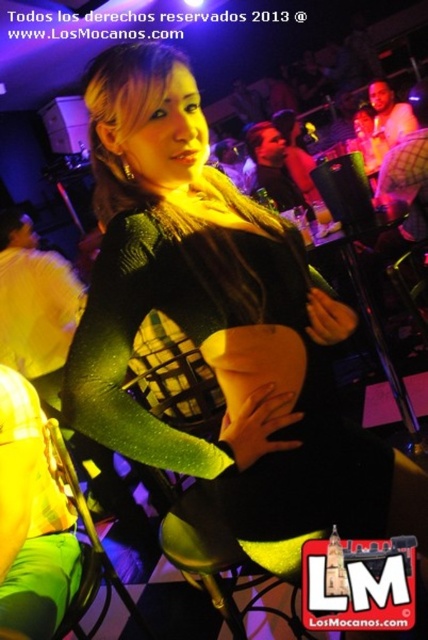
You are a photographer at the nightclub and want to capture a photo of the yellow fabric at left and the matte black shirt at upper right. Since you have a camera with a fixed focal length, you need to know which object is wider to ensure proper framing. Can you determine which one is wider?

The yellow fabric at left is wider than the matte black shirt at upper right, so you should frame the shot to accommodate the yellow fabric at left first.

You are at a party and want to take a photo of both the green sparkly dress at center and the green fabric shirt at lower left. Which object should you focus on first to ensure both are in frame?

You should focus on the green fabric shirt at lower left first because the green sparkly dress at center is to the right of it, so by starting with the shirt on the left, you can adjust the camera to include both in the frame.